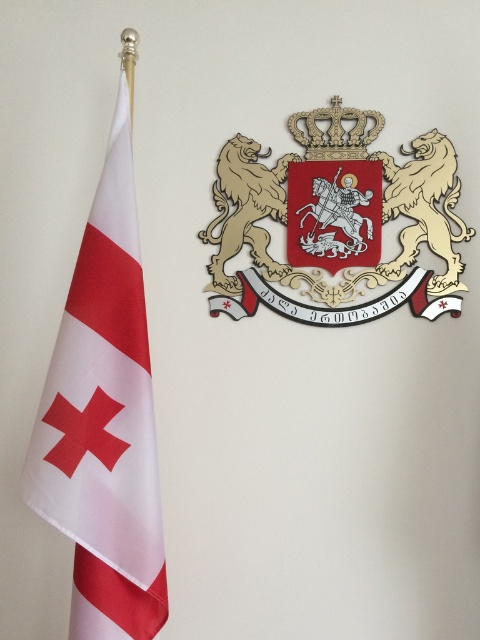
Question: Which point is closer to the camera taking this photo?

Choices:
 (A) (358, 236)
 (B) (39, 428)

Answer: (B)

Question: Can you confirm if white fabric flag at left is positioned to the left of gold textured coat of arms at upper right?

Choices:
 (A) yes
 (B) no

Answer: (A)

Question: Does white fabric flag at left appear on the right side of gold textured coat of arms at upper right?

Choices:
 (A) no
 (B) yes

Answer: (A)

Question: Does white fabric flag at left have a greater width compared to gold textured coat of arms at upper right?

Choices:
 (A) yes
 (B) no

Answer: (B)

Question: Which object appears closest to the camera in this image?

Choices:
 (A) gold textured coat of arms at upper right
 (B) white fabric flag at left

Answer: (B)